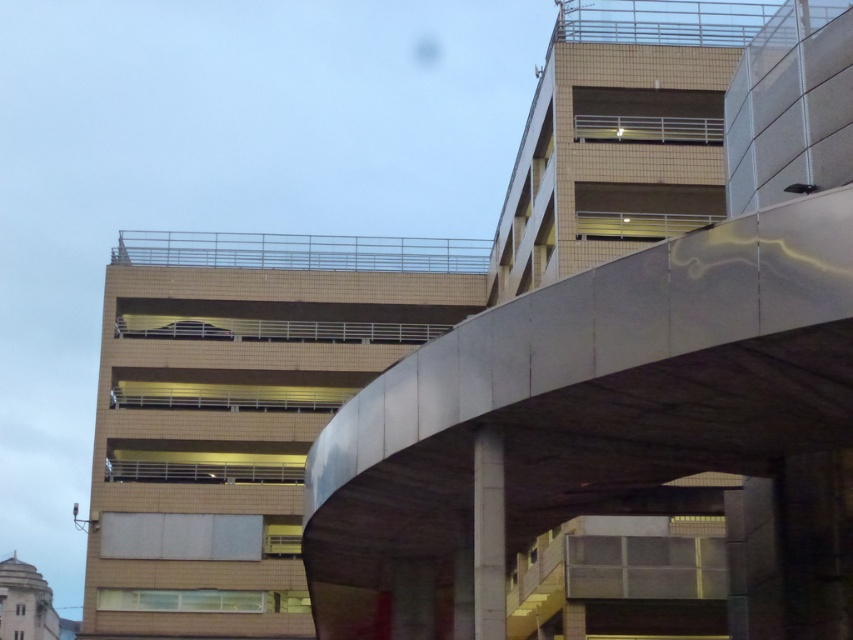
Based on the photo, you are a delivery driver entering the parking garage and need to navigate under the satin silver overpass at center and the beige tile parking garage at center. Which structure will you pass under first?

The satin silver overpass at center is shorter than the beige tile parking garage at center, so you will pass under the satin silver overpass at center first before reaching the beige tile parking garage at center.

You are a delivery driver entering the parking garage and need to locate the beige tile parking garage at center and the gray concrete pillar at center. According to the layout, which object is positioned to the left of the other?

The beige tile parking garage at center is to the left of the gray concrete pillar at center.